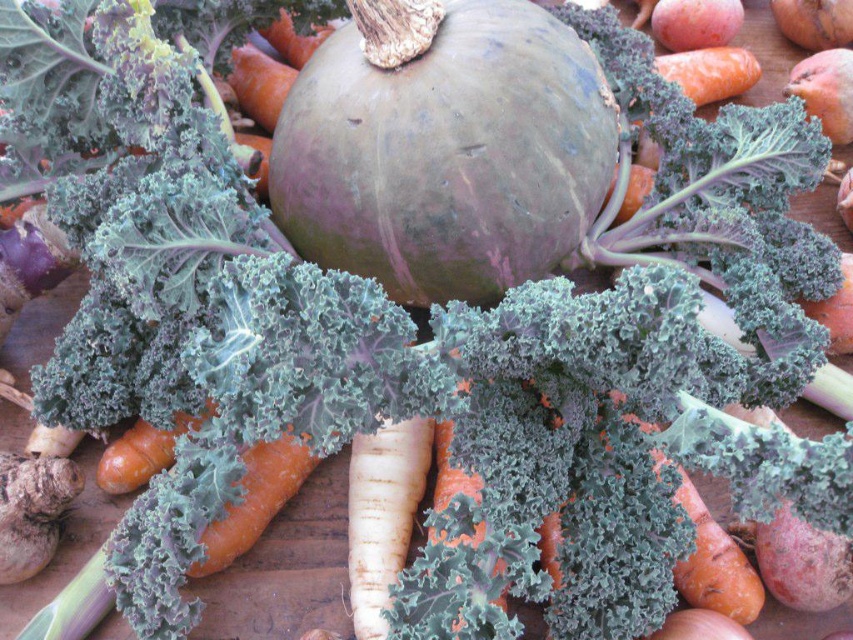
You are arranging vegetables on a wooden surface. You have an orange smooth carrot at center and a smooth brown onion at lower right. Which vegetable is taller?

The orange smooth carrot at center is taller than the smooth brown onion at lower right.

You are a chef preparing a vegetable platter and have two carrots in front of you on the wooden surface. The carrots are labeled as the orange matte carrot at center and the orange smooth carrot at center. Which carrot should you choose if you need the bigger one for your recipe?

The orange matte carrot at center is larger in size compared to the orange smooth carrot at center, so you should choose the orange matte carrot at center for your recipe.